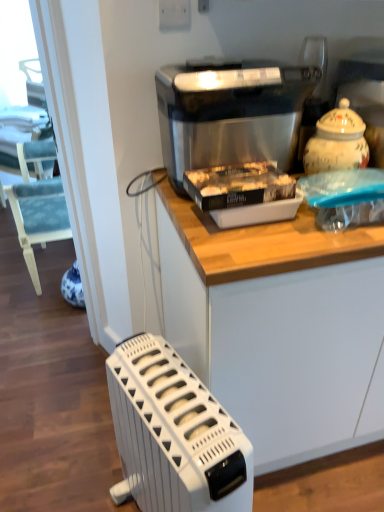
Describe the element at coordinates (174, 434) in the screenshot. The image size is (384, 512). I see `white plastic radiator at lower left` at that location.

Identify the location of white matte cabinet at upper center. [279, 326].

Is point (280, 75) positioned behind point (237, 447)?

Yes, it is.

Is stainless steel ice maker at center inside or outside of white plastic radiator at lower left?

stainless steel ice maker at center cannot be found inside white plastic radiator at lower left.

From a real-world perspective, does stainless steel ice maker at center sit lower than white plastic radiator at lower left?

No, from a real-world perspective, stainless steel ice maker at center is not under white plastic radiator at lower left.

How different are the orientations of stainless steel ice maker at center and white plastic radiator at lower left in degrees?

The facing directions of stainless steel ice maker at center and white plastic radiator at lower left are 14.1 degrees apart.

Between white matte cabinet at upper center and white plastic radiator at lower left, which one has more height?

white matte cabinet at upper center.

How far apart are white matte cabinet at upper center and white plastic radiator at lower left?

white matte cabinet at upper center is 11.32 inches from white plastic radiator at lower left.

Is point (329, 438) farther from viewer compared to point (138, 426)?

Yes, it is.

Which object is further away from the camera taking this photo, white matte cabinet at upper center or white plastic radiator at lower left?

white matte cabinet at upper center is behind.

From the picture: Between stainless steel ice maker at center and white matte cabinet at upper center, which one has less height?

stainless steel ice maker at center.

From the image's perspective, between stainless steel ice maker at center and white matte cabinet at upper center, who is located below?

white matte cabinet at upper center.

Consider the image. Which object is thinner, stainless steel ice maker at center or white matte cabinet at upper center?

Thinner between the two is stainless steel ice maker at center.

Can you confirm if white plastic radiator at lower left is wider than stainless steel ice maker at center?

Yes, white plastic radiator at lower left is wider than stainless steel ice maker at center.

Is white plastic radiator at lower left bigger or smaller than stainless steel ice maker at center?

Clearly, white plastic radiator at lower left is larger in size than stainless steel ice maker at center.

Which object is positioned more to the right, white plastic radiator at lower left or stainless steel ice maker at center?

From the viewer's perspective, stainless steel ice maker at center appears more on the right side.

Between white matte cabinet at upper center and stainless steel ice maker at center, which one is positioned behind?

stainless steel ice maker at center is further from the camera.

Considering the sizes of objects white matte cabinet at upper center and stainless steel ice maker at center in the image provided, who is wider, white matte cabinet at upper center or stainless steel ice maker at center?

white matte cabinet at upper center is wider.

This screenshot has width=384, height=512. I want to click on kitchen appliance above the white matte cabinet at upper center (from the image's perspective), so (x=230, y=114).

Can you confirm if white plastic radiator at lower left is wider than white matte cabinet at upper center?

No.

Consider the image. From a real-world perspective, is white plastic radiator at lower left beneath white matte cabinet at upper center?

Yes.

Is white matte cabinet at upper center at the back of white plastic radiator at lower left?

That's not correct — white plastic radiator at lower left is not looking away from white matte cabinet at upper center.

The image size is (384, 512). In order to click on kitchen appliance on the right of white plastic radiator at lower left in this screenshot , I will do `click(230, 114)`.

I want to click on home appliance on the left of white matte cabinet at upper center, so 174,434.

Looking at the image, which one is located further to white plastic radiator at lower left, white matte cabinet at upper center or stainless steel ice maker at center?

stainless steel ice maker at center is positioned further to the anchor white plastic radiator at lower left.

Which object lies nearer to the anchor point white matte cabinet at upper center, white plastic radiator at lower left or stainless steel ice maker at center?

The object closer to white matte cabinet at upper center is white plastic radiator at lower left.

Based on their spatial positions, is white plastic radiator at lower left or white matte cabinet at upper center further from stainless steel ice maker at center?

white plastic radiator at lower left lies further to stainless steel ice maker at center than the other object.

From the image, which object appears to be farther from white plastic radiator at lower left, stainless steel ice maker at center or white matte cabinet at upper center?

stainless steel ice maker at center is positioned further to the anchor white plastic radiator at lower left.

Based on the photo, from the image, which object appears to be nearer to white matte cabinet at upper center, stainless steel ice maker at center or white plastic radiator at lower left?

Among the two, white plastic radiator at lower left is located nearer to white matte cabinet at upper center.

Looking at the image, which one is located further to stainless steel ice maker at center, white matte cabinet at upper center or white plastic radiator at lower left?

white plastic radiator at lower left lies further to stainless steel ice maker at center than the other object.

Image resolution: width=384 pixels, height=512 pixels. Find the location of `cabinetry between stainless steel ice maker at center and white plastic radiator at lower left in the vertical direction`. cabinetry between stainless steel ice maker at center and white plastic radiator at lower left in the vertical direction is located at coordinates (279, 326).